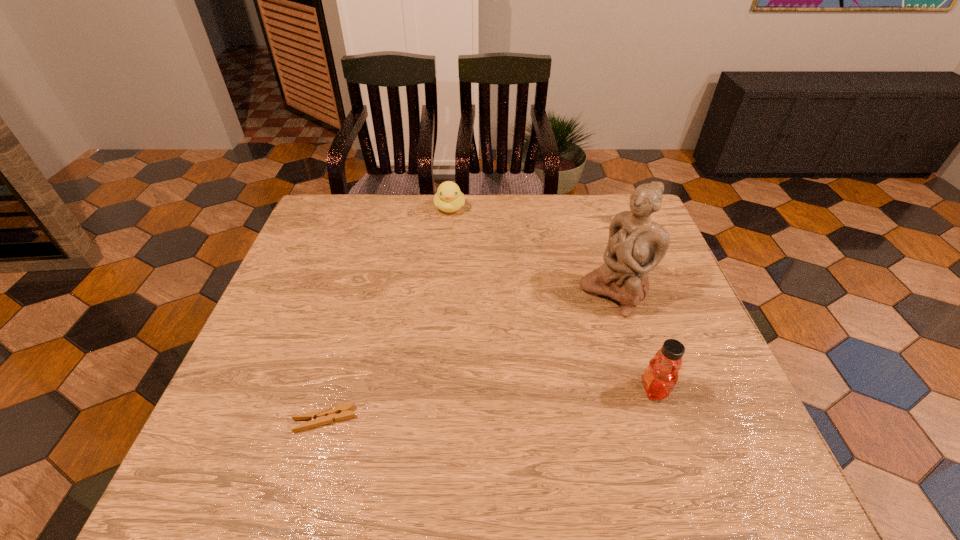
Find the location of a particular element. The image size is (960, 540). free space on the desktop that is between the nearest object and the honey and is positioned on the front-facing side of the second farthest object is located at coordinates (473, 406).

Find the location of a particular element. This screenshot has width=960, height=540. vacant spot on the desktop that is between the leftmost object and the third shortest object and is positioned at the beak of the duckling is located at coordinates (451, 408).